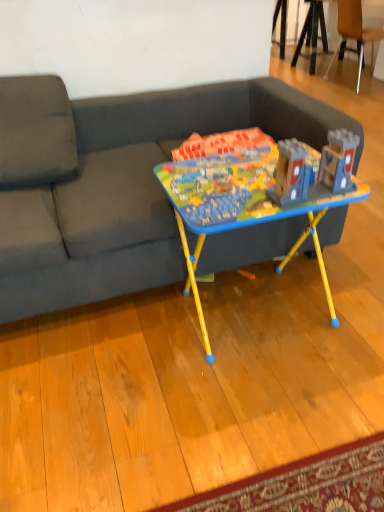
Identify the location of vacant region in front of matte plastic table at center. Image resolution: width=384 pixels, height=512 pixels. (255, 406).